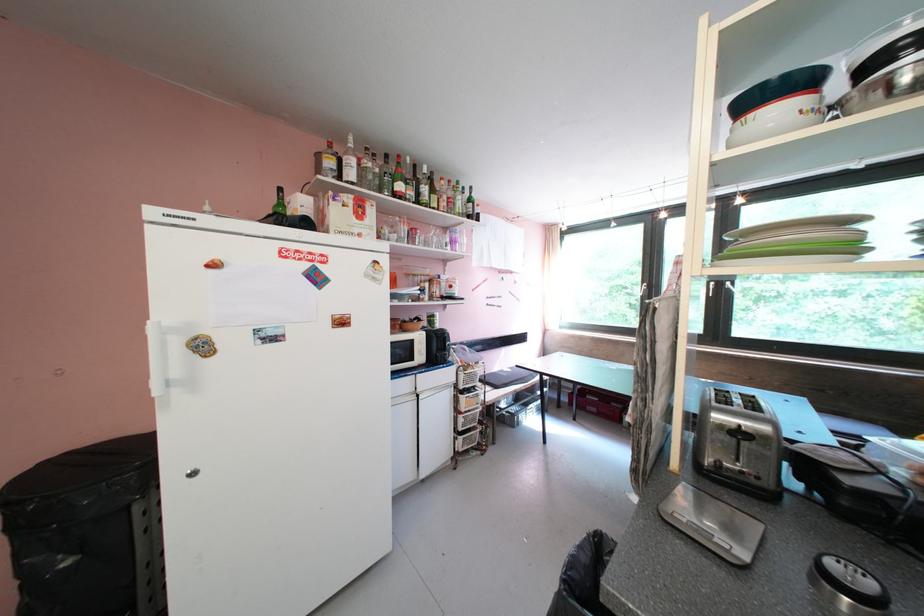
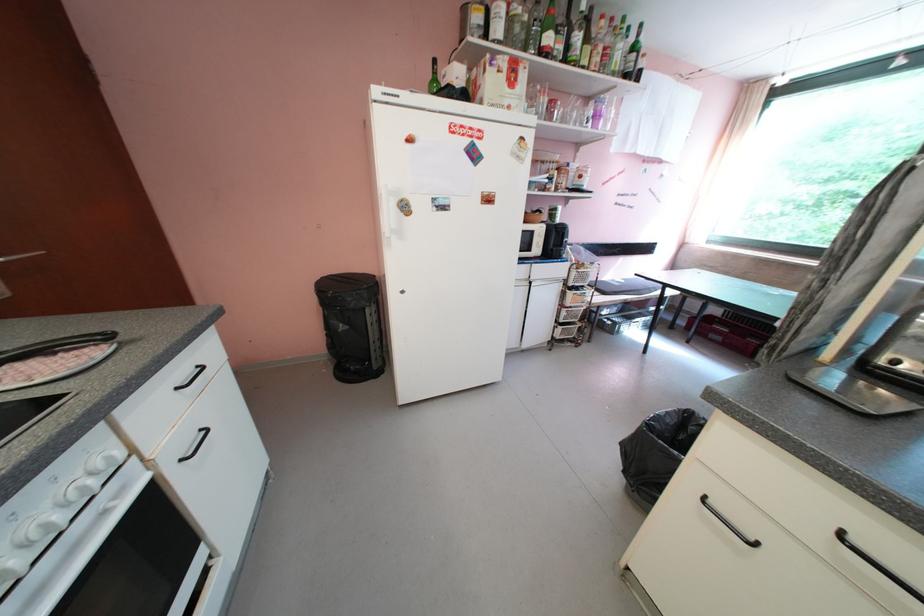
Find the pixel in the second image that matches the point at 468,216 in the first image.

(622, 75)